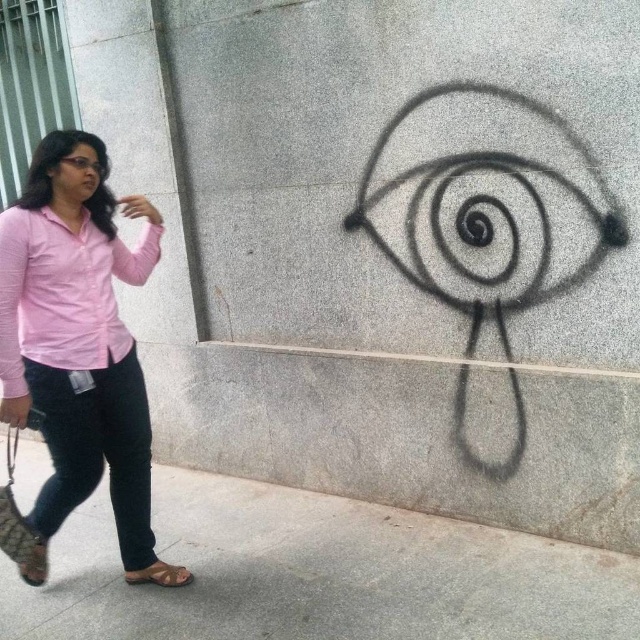
Question: Can you confirm if brown leather sandal at lower left is positioned to the left of black spray paint eye at upper right?

Choices:
 (A) no
 (B) yes

Answer: (A)

Question: Is pink matte shirt at left to the left of black spray paint eye at upper right from the viewer's perspective?

Choices:
 (A) no
 (B) yes

Answer: (B)

Question: Based on their relative distances, which object is farther from the pink cotton shirt at left?

Choices:
 (A) brown leather sandal at lower left
 (B) pink matte shirt at left
 (C) leather textured sandal at lower left

Answer: (A)

Question: Which point appears closest to the camera in this image?

Choices:
 (A) (42, 572)
 (B) (550, 604)
 (C) (4, 218)
 (D) (33, 339)

Answer: (C)

Question: Does brown leather sandal at lower left appear on the right side of black spray paint eye at upper right?

Choices:
 (A) no
 (B) yes

Answer: (B)

Question: Which of the following is the farthest from the observer?

Choices:
 (A) (72, 161)
 (B) (141, 579)

Answer: (B)